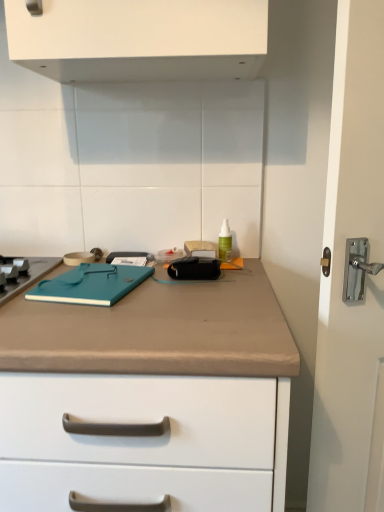
This screenshot has width=384, height=512. Find the location of `beige matte countertop at center`. beige matte countertop at center is located at coordinates (149, 397).

Find the location of a particular element. The width and height of the screenshot is (384, 512). teal matte notebook at center is located at coordinates (91, 284).

This screenshot has width=384, height=512. What do you see at coordinates (225, 241) in the screenshot?
I see `green translucent bottle at center` at bounding box center [225, 241].

At what (x,y) coordinates should I click in order to perform the action: click on beige matte countertop at center. Please return your answer as a coordinate pair (x, y). Looking at the image, I should click on (149, 397).

Is beige matte countertop at center oriented away from teal matte notebook at center?

beige matte countertop at center is not turned away from teal matte notebook at center.

Is beige matte countertop at center in front of teal matte notebook at center?

Yes.

This screenshot has width=384, height=512. I want to click on counter located in front of the teal matte notebook at center, so click(149, 397).

Is beige matte countertop at center in contact with teal matte notebook at center?

No, beige matte countertop at center is not touching teal matte notebook at center.

Does teal matte notebook at center turn towards green translucent bottle at center?

No, teal matte notebook at center is not oriented towards green translucent bottle at center.

Locate an element on the screen. The image size is (384, 512). notebook in front of the green translucent bottle at center is located at coordinates (91, 284).

From the image's perspective, relative to green translucent bottle at center, is teal matte notebook at center above or below?

Clearly, from the image's perspective, teal matte notebook at center is below green translucent bottle at center.

Based on the photo, from a real-world perspective, is teal matte notebook at center located higher than green translucent bottle at center?

Incorrect, from a real-world perspective, teal matte notebook at center is lower than green translucent bottle at center.

Is point (24, 412) positioned behind point (230, 256)?

No, (24, 412) is closer to viewer.

Visually, is beige matte countertop at center positioned to the left or to the right of green translucent bottle at center?

beige matte countertop at center is positioned on green translucent bottle at center's left side.

Where is `bottle on the right of beige matte countertop at center`? This screenshot has height=512, width=384. bottle on the right of beige matte countertop at center is located at coordinates (225, 241).

Looking at this image, from the image's perspective, relative to green translucent bottle at center, is beige matte countertop at center above or below?

Clearly, from the image's perspective, beige matte countertop at center is below green translucent bottle at center.

Is teal matte notebook at center bigger than beige matte countertop at center?

No.

Is beige matte countertop at center inside teal matte notebook at center?

No.

In the scene shown: Measure the distance between teal matte notebook at center and beige matte countertop at center.

teal matte notebook at center and beige matte countertop at center are 19.32 centimeters apart.

Considering their positions, is teal matte notebook at center located in front of or behind beige matte countertop at center?

Clearly, teal matte notebook at center is behind beige matte countertop at center.

Does green translucent bottle at center have a smaller size compared to beige matte countertop at center?

Correct, green translucent bottle at center occupies less space than beige matte countertop at center.

Would you say beige matte countertop at center is part of green translucent bottle at center's contents?

Actually, beige matte countertop at center is outside green translucent bottle at center.

From the image's perspective, between green translucent bottle at center and beige matte countertop at center, who is located below?

beige matte countertop at center.

Can teal matte notebook at center be found inside green translucent bottle at center?

No, teal matte notebook at center is not inside green translucent bottle at center.

Find the location of a particular element. The height and width of the screenshot is (512, 384). bottle above the teal matte notebook at center (from a real-world perspective) is located at coordinates (225, 241).

Is green translucent bottle at center facing towards teal matte notebook at center?

No, green translucent bottle at center is not oriented towards teal matte notebook at center.

Between green translucent bottle at center and teal matte notebook at center, which one has smaller width?

green translucent bottle at center is thinner.

Locate an element on the screen. This screenshot has height=512, width=384. notebook above the beige matte countertop at center (from a real-world perspective) is located at coordinates (91, 284).

Locate an element on the screen. bottle on the right side of teal matte notebook at center is located at coordinates (225, 241).

Looking at this image, from the image, which object appears to be nearer to beige matte countertop at center, green translucent bottle at center or teal matte notebook at center?

Among the two, teal matte notebook at center is located nearer to beige matte countertop at center.

From the image, which object appears to be nearer to beige matte countertop at center, teal matte notebook at center or green translucent bottle at center?

Based on the image, teal matte notebook at center appears to be nearer to beige matte countertop at center.

Based on their spatial positions, is green translucent bottle at center or beige matte countertop at center closer to teal matte notebook at center?

Based on the image, beige matte countertop at center appears to be nearer to teal matte notebook at center.

Considering their positions, is teal matte notebook at center positioned closer to green translucent bottle at center than beige matte countertop at center?

teal matte notebook at center is positioned closer to the anchor green translucent bottle at center.

Consider the image. Looking at the image, which one is located closer to green translucent bottle at center, beige matte countertop at center or teal matte notebook at center?

The object closer to green translucent bottle at center is teal matte notebook at center.

From the image, which object appears to be farther from teal matte notebook at center, beige matte countertop at center or green translucent bottle at center?

green translucent bottle at center lies further to teal matte notebook at center than the other object.

Locate an element on the screen. The width and height of the screenshot is (384, 512). notebook between green translucent bottle at center and beige matte countertop at center from top to bottom is located at coordinates (91, 284).